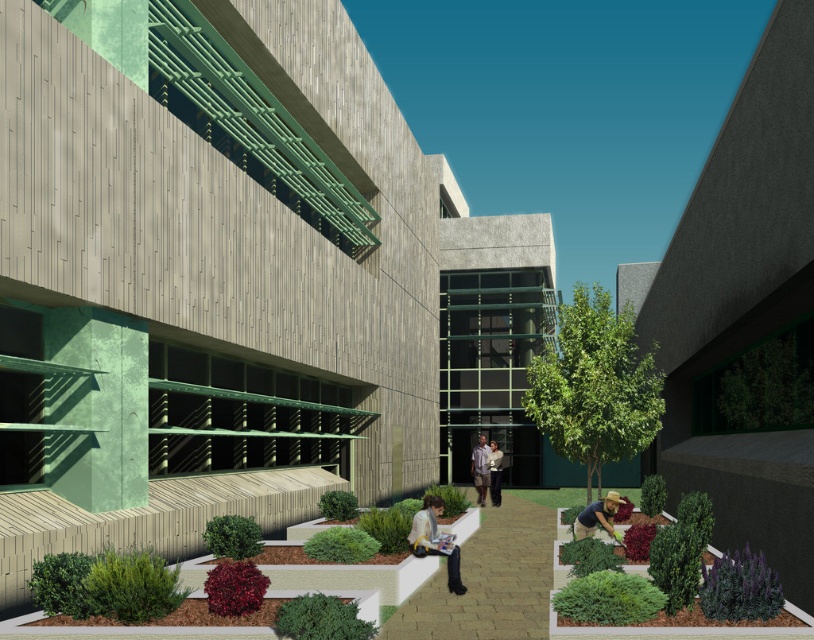
You are a delivery person standing at the entrance of the left building and need to hand over a package to someone wearing the light brown shirt at center. However, there is a yellow fabric bag at center blocking your path. Can you still reach the person without moving the bag?

The yellow fabric bag at center is in front of the light brown shirt at center, meaning the bag is blocking the direct path. To reach the person without moving the bag, you would need to go around it either to the left or right side.

You are a delivery drone flying over the courtyard between the two buildings. You need to land at a specific location. Which of the two points, point (453,588) or point (484,488), is closer to you as you approach from above?

Point (453,588) is in front of point (484,488), so it is closer to you as you approach from above.

You are a pedestrian walking through the courtyard. You see a smooth beige stone path at center and a light brown shirt at center. Which object is larger in size?

The smooth beige stone path at center is bigger than the light brown shirt at center.